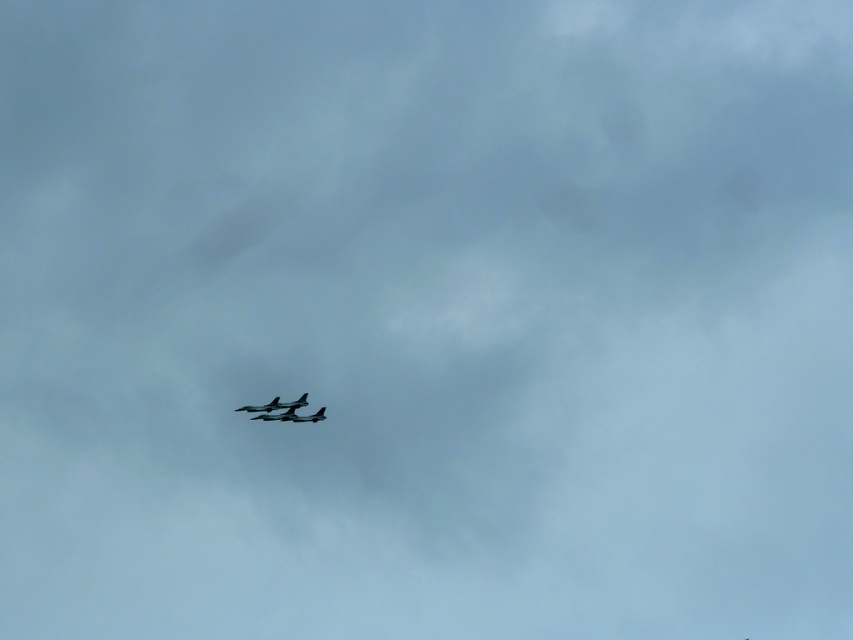
Question: Is shiny dark gray jet at center closer to camera compared to shiny silver airplane at center?

Choices:
 (A) no
 (B) yes

Answer: (A)

Question: Can you confirm if shiny dark gray jet at center is smaller than shiny silver airplane at center?

Choices:
 (A) no
 (B) yes

Answer: (A)

Question: Which point is farther to the camera?

Choices:
 (A) (323, 410)
 (B) (270, 406)

Answer: (A)

Question: Can you confirm if shiny dark gray jet at center is smaller than shiny silver airplane at center?

Choices:
 (A) yes
 (B) no

Answer: (B)

Question: Which point is closer to the camera?

Choices:
 (A) (291, 406)
 (B) (300, 419)

Answer: (A)